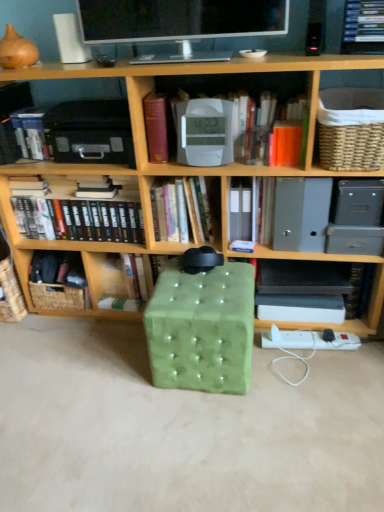
Where is `vacant point above green velvet ottoman at center (from a real-world perspective)`? The image size is (384, 512). vacant point above green velvet ottoman at center (from a real-world perspective) is located at coordinates (208, 282).